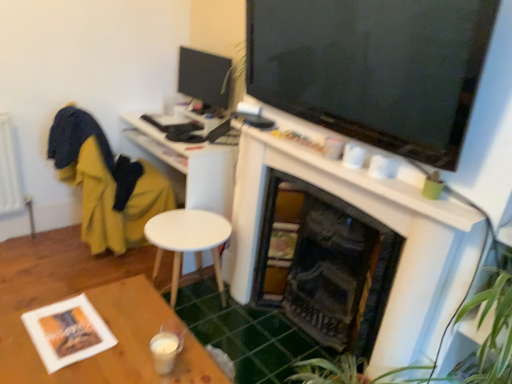
Image resolution: width=512 pixels, height=384 pixels. Find the location of `vacant area that is in front of yellow fabric swivel chair at left`. vacant area that is in front of yellow fabric swivel chair at left is located at coordinates (80, 269).